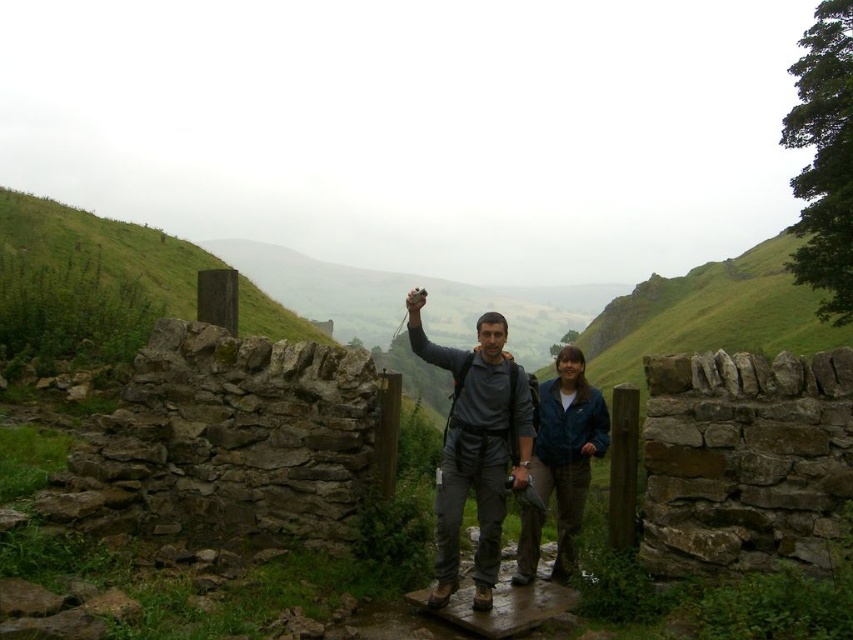
Question: Estimate the real-world distances between objects in this image. Which object is farther from the blue fabric jacket at center?

Choices:
 (A) green grass at upper left
 (B) matte gray backpack at center

Answer: (A)

Question: Is green grass at upper left to the right of blue fabric jacket at center from the viewer's perspective?

Choices:
 (A) yes
 (B) no

Answer: (B)

Question: Does green grass at upper left have a larger size compared to blue fabric jacket at center?

Choices:
 (A) yes
 (B) no

Answer: (A)

Question: Which of these objects is positioned farthest from the matte gray backpack at center?

Choices:
 (A) blue fabric jacket at center
 (B) green grass at upper left

Answer: (B)

Question: Based on their relative distances, which object is farther from the green grass at upper left?

Choices:
 (A) matte gray backpack at center
 (B) blue fabric jacket at center

Answer: (B)

Question: Does matte gray backpack at center appear under blue fabric jacket at center?

Choices:
 (A) yes
 (B) no

Answer: (B)